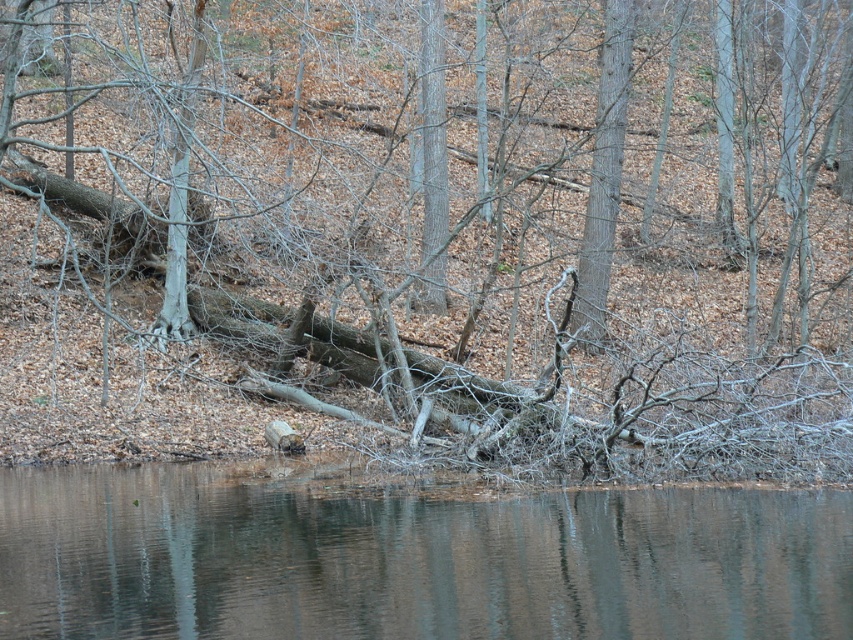
Who is taller, brown wood tree at center or brown smooth water at lower center?

Standing taller between the two is brown wood tree at center.

Is point (699, 92) less distant than point (450, 632)?

No.

Image resolution: width=853 pixels, height=640 pixels. Find the location of `brown wood tree at center`. brown wood tree at center is located at coordinates (434, 221).

This screenshot has height=640, width=853. In order to click on brown wood tree at center in this screenshot , I will do pos(434,221).

Based on the photo, between brown wood tree at center and smooth bark tree at center, which one is positioned higher?

brown wood tree at center

Is brown wood tree at center to the right of smooth bark tree at center from the viewer's perspective?

Incorrect, brown wood tree at center is not on the right side of smooth bark tree at center.

Describe the element at coordinates (434, 221) in the screenshot. I see `brown wood tree at center` at that location.

The image size is (853, 640). I want to click on brown wood tree at center, so 434,221.

Between brown smooth water at lower center and smooth bark tree at center, which one appears on the left side from the viewer's perspective?

From the viewer's perspective, brown smooth water at lower center appears more on the left side.

Between point (144, 506) and point (596, 308), which one is positioned behind?

Positioned behind is point (596, 308).

At what (x,y) coordinates should I click in order to perform the action: click on brown smooth water at lower center. Please return your answer as a coordinate pair (x, y). Looking at the image, I should click on (410, 557).